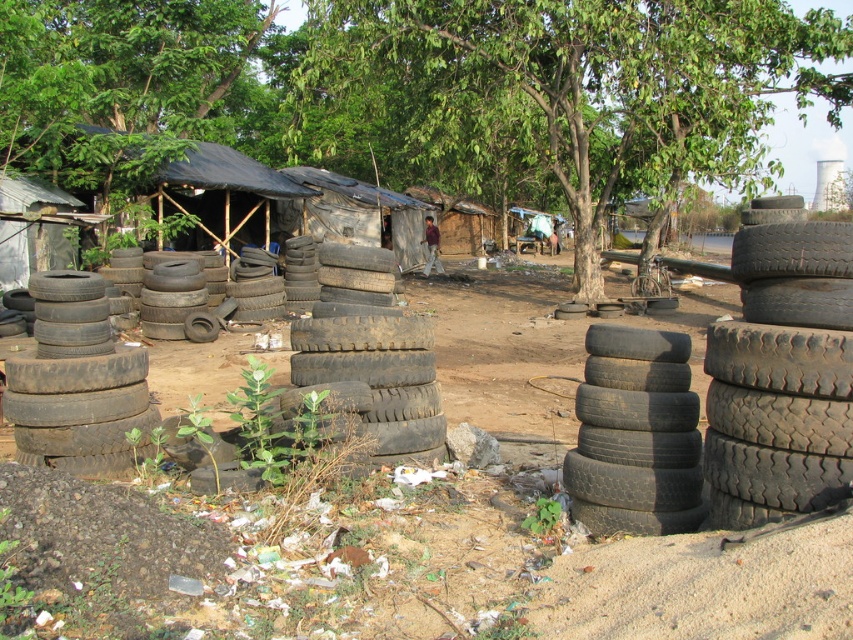
Can you confirm if green leafy tree at center is positioned to the right of green leafy tree at upper center?

Correct, you'll find green leafy tree at center to the right of green leafy tree at upper center.

Where is `green leafy tree at center`? The width and height of the screenshot is (853, 640). green leafy tree at center is located at coordinates (560, 93).

The image size is (853, 640). I want to click on green leafy tree at center, so click(560, 93).

Which is behind, point (367, 401) or point (364, 408)?

The point (364, 408) is behind.

Does dull brown dirt at center appear under black rubber tires at center?

Yes.

You are a GUI agent. You are given a task and a screenshot of the screen. Output one action in this format:
    pyautogui.click(x=<x>, y=<y>)
    Task: Click on the dull brown dirt at center
    
    Given the screenshot: What is the action you would take?
    pyautogui.click(x=102, y=534)

Is point (717, 353) less distant than point (70, 355)?

Yes, it is.

Can you confirm if black rubber tires at right is positioned to the left of dark grey rubber tire at left?

In fact, black rubber tires at right is to the right of dark grey rubber tire at left.

Where is `black rubber tires at right`? This screenshot has width=853, height=640. black rubber tires at right is located at coordinates (781, 376).